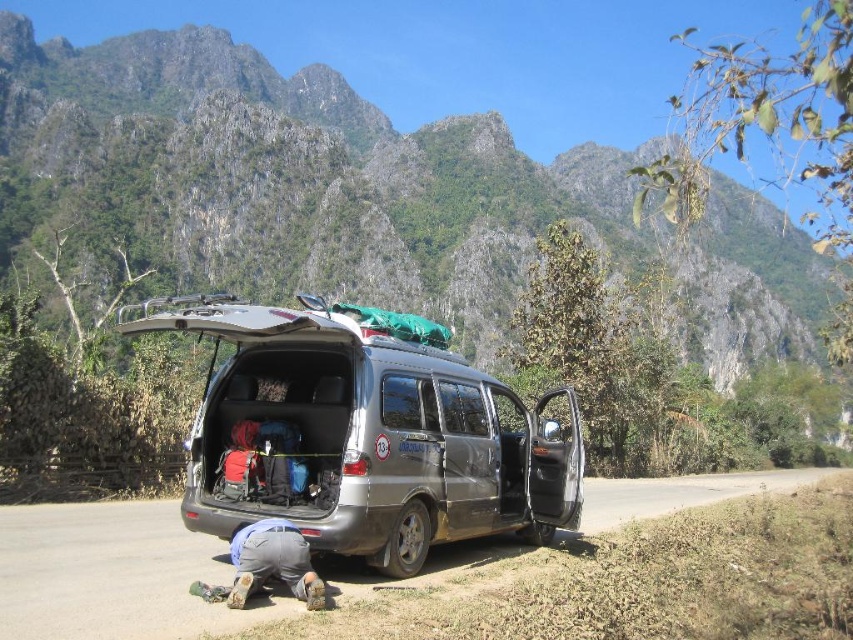
You are a hiker who wants to take a break near the silver metallic van at center and the gray fabric squat at lower center. Which object is closer to you so you can rest there first?

The gray fabric squat at lower center is closer to you, so you can rest there first since it is nearer than the silver metallic van at center.

You are standing at the base of the mountain and want to reach the silver minivan parked nearby. According to the map, the gray asphalt road at lower center is the only path available. Can you determine the direction you should head to follow the road towards the minivan?

The gray asphalt road at lower center is located at point [108,573], so you should head towards that coordinate to follow the road towards the minivan.

You are a hiker planning to cross the gray asphalt road at lower center to reach the mountains. The silver metallic van at center is parked nearby. Considering the van and road, which one is taller?

The silver metallic van at center is taller than the gray asphalt road at lower center.